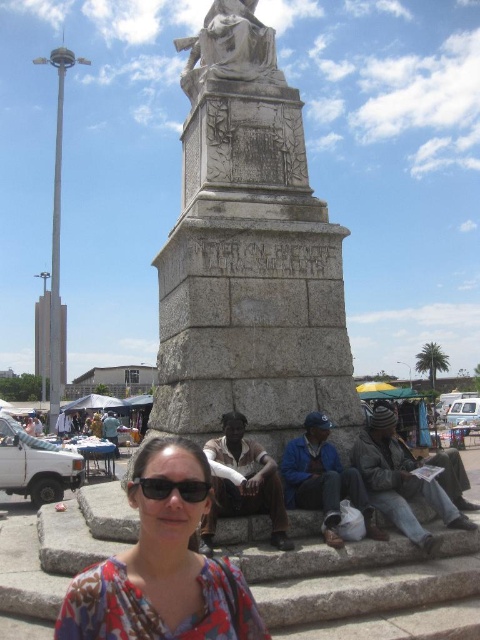
You are a photographer standing at the edge of the square. You want to capture both the gray stone monument at center and the floral fabric blouse at lower center in the same frame. Considering their sizes, which object will appear larger in your photo?

The gray stone monument at center will appear larger in the photo because it has a greater height compared to the floral fabric blouse at lower center.